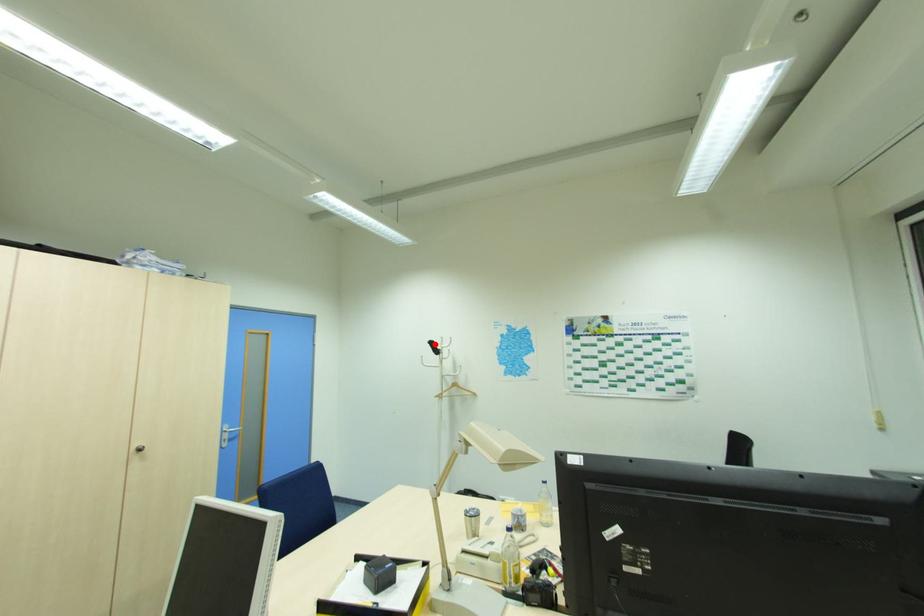
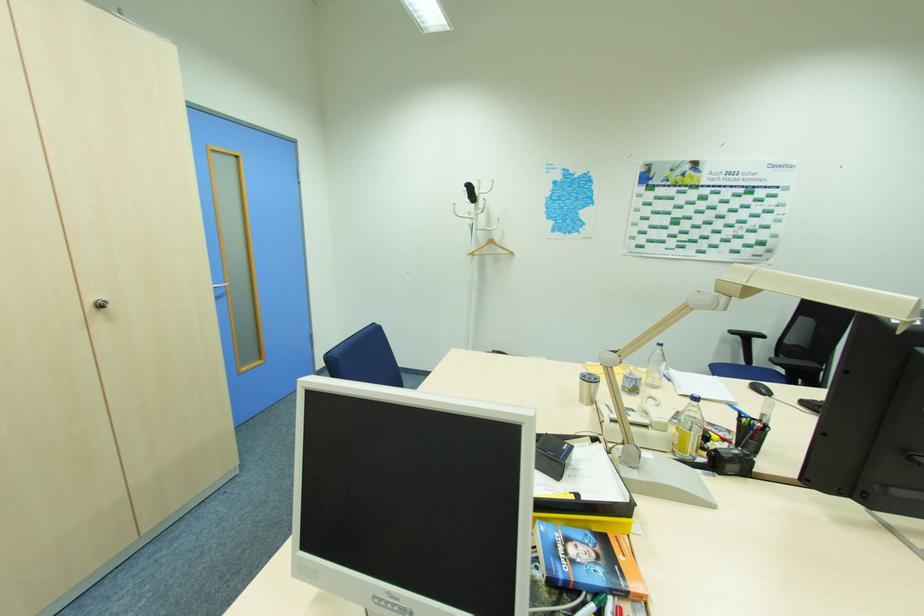
Locate, in the second image, the point that corresponds to the highlighted location in the first image.

(472, 188)